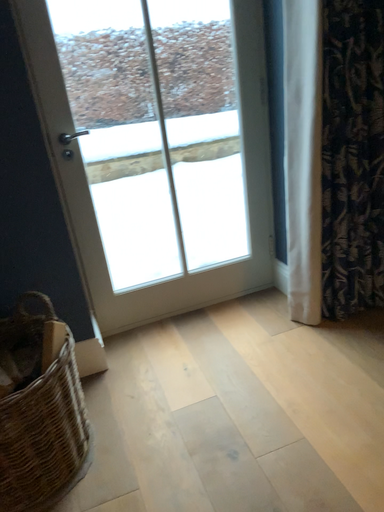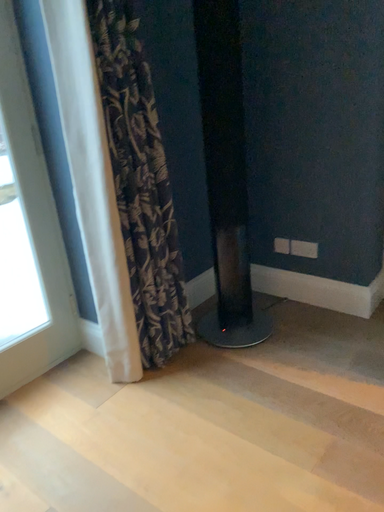
Question: How did the camera likely rotate when shooting the video?

Choices:
 (A) rotated left
 (B) rotated right

Answer: (B)